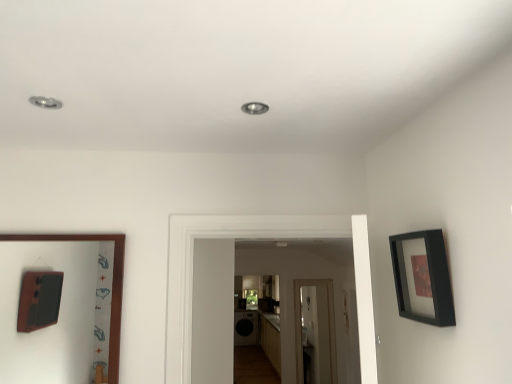
Locate an element on the screen. Image resolution: width=512 pixels, height=384 pixels. black matte picture frame at upper right, arranged as the 1th picture frame when viewed from the front is located at coordinates point(422,277).

Image resolution: width=512 pixels, height=384 pixels. What do you see at coordinates (422, 277) in the screenshot?
I see `black matte picture frame at upper right, arranged as the 1th picture frame when viewed from the front` at bounding box center [422, 277].

Describe the element at coordinates (60, 307) in the screenshot. This screenshot has height=384, width=512. I see `wooden picture frame at left, which is the first picture frame in left-to-right order` at that location.

At what (x,y) coordinates should I click in order to perform the action: click on wooden picture frame at left, the second picture frame positioned from the front. Please return your answer as a coordinate pair (x, y). This screenshot has height=384, width=512. Looking at the image, I should click on tap(60, 307).

Locate an element on the screen. black matte picture frame at upper right, which appears as the second picture frame when viewed from the left is located at coordinates (422, 277).

In the scene shown: Visually, is black matte picture frame at upper right, arranged as the 1th picture frame when viewed from the front, positioned to the left or to the right of wooden picture frame at left, which is counted as the 2th picture frame, starting from the right?

Clearly, black matte picture frame at upper right, arranged as the 1th picture frame when viewed from the front, is on the right of wooden picture frame at left, which is counted as the 2th picture frame, starting from the right, in the image.

Considering the relative positions of black matte picture frame at upper right, which is the first picture frame from right to left, and wooden picture frame at left, which is the first picture frame in left-to-right order, in the image provided, is black matte picture frame at upper right, which is the first picture frame from right to left, behind wooden picture frame at left, which is the first picture frame in left-to-right order,?

No, it is in front of wooden picture frame at left, which is the first picture frame in left-to-right order.

Which is further, (425, 237) or (100, 269)?

Positioned behind is point (100, 269).

From the image's perspective, is black matte picture frame at upper right, which is the first picture frame from right to left, located above or below wooden picture frame at left, which is the first picture frame in left-to-right order?

black matte picture frame at upper right, which is the first picture frame from right to left, is situated higher than wooden picture frame at left, which is the first picture frame in left-to-right order, in the image.

From a real-world perspective, is black matte picture frame at upper right, which appears as the second picture frame when viewed from the left, physically located above or below wooden picture frame at left, the second picture frame positioned from the front?

black matte picture frame at upper right, which appears as the second picture frame when viewed from the left, is situated higher than wooden picture frame at left, the second picture frame positioned from the front, in the real world.

Considering the relative sizes of black matte picture frame at upper right, arranged as the 1th picture frame when viewed from the front, and wooden picture frame at left, which is the first picture frame in left-to-right order, in the image provided, is black matte picture frame at upper right, arranged as the 1th picture frame when viewed from the front, thinner than wooden picture frame at left, which is the first picture frame in left-to-right order,?

No, black matte picture frame at upper right, arranged as the 1th picture frame when viewed from the front, is not thinner than wooden picture frame at left, which is the first picture frame in left-to-right order.

Is black matte picture frame at upper right, which appears as the second picture frame when viewed from the left, shorter than wooden picture frame at left, which is the 1th picture frame from back to front?

Correct, black matte picture frame at upper right, which appears as the second picture frame when viewed from the left, is not as tall as wooden picture frame at left, which is the 1th picture frame from back to front.

Can you confirm if black matte picture frame at upper right, which is the first picture frame from right to left, is bigger than wooden picture frame at left, which is counted as the 2th picture frame, starting from the right?

Incorrect, black matte picture frame at upper right, which is the first picture frame from right to left, is not larger than wooden picture frame at left, which is counted as the 2th picture frame, starting from the right.

Is wooden picture frame at left, which is the 1th picture frame from back to front, completely or partially inside black matte picture frame at upper right, arranged as the 1th picture frame when viewed from the front?

That's incorrect, wooden picture frame at left, which is the 1th picture frame from back to front, is not inside black matte picture frame at upper right, arranged as the 1th picture frame when viewed from the front.

Is black matte picture frame at upper right, which is the first picture frame from right to left, not near wooden picture frame at left, the second picture frame positioned from the front?

Indeed, black matte picture frame at upper right, which is the first picture frame from right to left, is not near wooden picture frame at left, the second picture frame positioned from the front.

Is black matte picture frame at upper right, arranged as the 1th picture frame when viewed from the front, facing away from wooden picture frame at left, the second picture frame positioned from the front?

No.

How many degrees apart are the facing directions of black matte picture frame at upper right, which is the first picture frame from right to left, and wooden picture frame at left, which is the first picture frame in left-to-right order?

90 degrees.

Measure the distance from black matte picture frame at upper right, arranged as the 1th picture frame when viewed from the front, to wooden picture frame at left, which is counted as the 2th picture frame, starting from the right.

2.56 meters.

Where is `picture frame behind the black matte picture frame at upper right, arranged as the 1th picture frame when viewed from the front`? Image resolution: width=512 pixels, height=384 pixels. picture frame behind the black matte picture frame at upper right, arranged as the 1th picture frame when viewed from the front is located at coordinates (60, 307).

Which object is positioned more to the right, wooden picture frame at left, which is the 1th picture frame from back to front, or black matte picture frame at upper right, which is the 2th picture frame in back-to-front order?

black matte picture frame at upper right, which is the 2th picture frame in back-to-front order.

Considering their positions, is wooden picture frame at left, which is counted as the 2th picture frame, starting from the right, located in front of or behind black matte picture frame at upper right, which is the 2th picture frame in back-to-front order?

wooden picture frame at left, which is counted as the 2th picture frame, starting from the right, is behind black matte picture frame at upper right, which is the 2th picture frame in back-to-front order.

Which point is more forward, (6, 285) or (419, 240)?

The point (419, 240) is in front.

From the image's perspective, between wooden picture frame at left, which is the first picture frame in left-to-right order, and black matte picture frame at upper right, which appears as the second picture frame when viewed from the left, which one is located above?

black matte picture frame at upper right, which appears as the second picture frame when viewed from the left, from the image's perspective.

From a real-world perspective, which object stands above the other?

From a 3D spatial view, black matte picture frame at upper right, arranged as the 1th picture frame when viewed from the front, is above.

Does wooden picture frame at left, the second picture frame positioned from the front, have a lesser width compared to black matte picture frame at upper right, arranged as the 1th picture frame when viewed from the front?

Yes.

Considering the relative sizes of wooden picture frame at left, which is the first picture frame in left-to-right order, and black matte picture frame at upper right, which is the 2th picture frame in back-to-front order, in the image provided, is wooden picture frame at left, which is the first picture frame in left-to-right order, taller than black matte picture frame at upper right, which is the 2th picture frame in back-to-front order,?

Indeed, wooden picture frame at left, which is the first picture frame in left-to-right order, has a greater height compared to black matte picture frame at upper right, which is the 2th picture frame in back-to-front order.

Does wooden picture frame at left, the second picture frame positioned from the front, have a larger size compared to black matte picture frame at upper right, which is the first picture frame from right to left?

Indeed, wooden picture frame at left, the second picture frame positioned from the front, has a larger size compared to black matte picture frame at upper right, which is the first picture frame from right to left.

Is black matte picture frame at upper right, arranged as the 1th picture frame when viewed from the front, inside wooden picture frame at left, the second picture frame positioned from the front?

No, black matte picture frame at upper right, arranged as the 1th picture frame when viewed from the front, is not inside wooden picture frame at left, the second picture frame positioned from the front.

Is there a large distance between wooden picture frame at left, the second picture frame positioned from the front, and black matte picture frame at upper right, arranged as the 1th picture frame when viewed from the front?

Yes.

Is wooden picture frame at left, which is the first picture frame in left-to-right order, oriented away from black matte picture frame at upper right, which is the 2th picture frame in back-to-front order?

No.

Identify the location of picture frame on the right of wooden picture frame at left, which is the first picture frame in left-to-right order. (422, 277).

Where is `picture frame behind the black matte picture frame at upper right, arranged as the 1th picture frame when viewed from the front`? picture frame behind the black matte picture frame at upper right, arranged as the 1th picture frame when viewed from the front is located at coordinates (60, 307).

This screenshot has width=512, height=384. I want to click on picture frame that appears on the left of black matte picture frame at upper right, which is the 2th picture frame in back-to-front order, so click(60, 307).